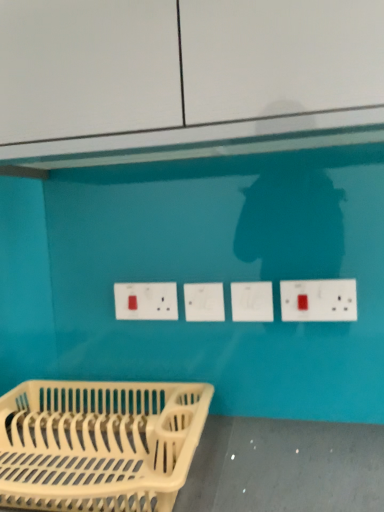
Question: Considering the relative sizes of white plastic socket at center, the 1th socket viewed from the right, and white plastic dish rack at lower left in the image provided, is white plastic socket at center, the 1th socket viewed from the right, bigger than white plastic dish rack at lower left?

Choices:
 (A) yes
 (B) no

Answer: (B)

Question: Considering the relative sizes of white plastic socket at center, the 1th socket viewed from the right, and white plastic dish rack at lower left in the image provided, is white plastic socket at center, the 1th socket viewed from the right, taller than white plastic dish rack at lower left?

Choices:
 (A) no
 (B) yes

Answer: (A)

Question: Would you say white plastic dish rack at lower left is part of white plastic socket at center, the 1th socket viewed from the right,'s contents?

Choices:
 (A) yes
 (B) no

Answer: (B)

Question: From the image's perspective, is white plastic socket at center, which is the 2th socket in left-to-right order, under white plastic dish rack at lower left?

Choices:
 (A) no
 (B) yes

Answer: (A)

Question: From a real-world perspective, is white plastic socket at center, which is the 2th socket in left-to-right order, under white plastic dish rack at lower left?

Choices:
 (A) no
 (B) yes

Answer: (A)

Question: Would you say white plastic socket at center, the 1th socket viewed from the right, is outside white plastic dish rack at lower left?

Choices:
 (A) no
 (B) yes

Answer: (B)

Question: Is white plastic dish rack at lower left shorter than white plastic socket at center, the 1th socket viewed from the right?

Choices:
 (A) no
 (B) yes

Answer: (A)

Question: Is the depth of white plastic dish rack at lower left less than that of white plastic socket at center, the 1th socket viewed from the right?

Choices:
 (A) no
 (B) yes

Answer: (B)

Question: Is white plastic dish rack at lower left beside white plastic socket at center, which is the 2th socket in left-to-right order?

Choices:
 (A) yes
 (B) no

Answer: (B)

Question: Does white plastic dish rack at lower left turn towards white plastic socket at center, which is the 2th socket in left-to-right order?

Choices:
 (A) yes
 (B) no

Answer: (B)

Question: Does white plastic dish rack at lower left appear on the right side of white plastic socket at center, the 1th socket viewed from the right?

Choices:
 (A) no
 (B) yes

Answer: (A)

Question: Is white plastic dish rack at lower left taller than white plastic socket at center, which is the 2th socket in left-to-right order?

Choices:
 (A) no
 (B) yes

Answer: (B)

Question: From the image's perspective, is white plastic socket at center, arranged as the 1th socket when viewed from the left, below white plastic electrical outlet at center, marked as the second electric outlet in a right-to-left arrangement?

Choices:
 (A) yes
 (B) no

Answer: (A)